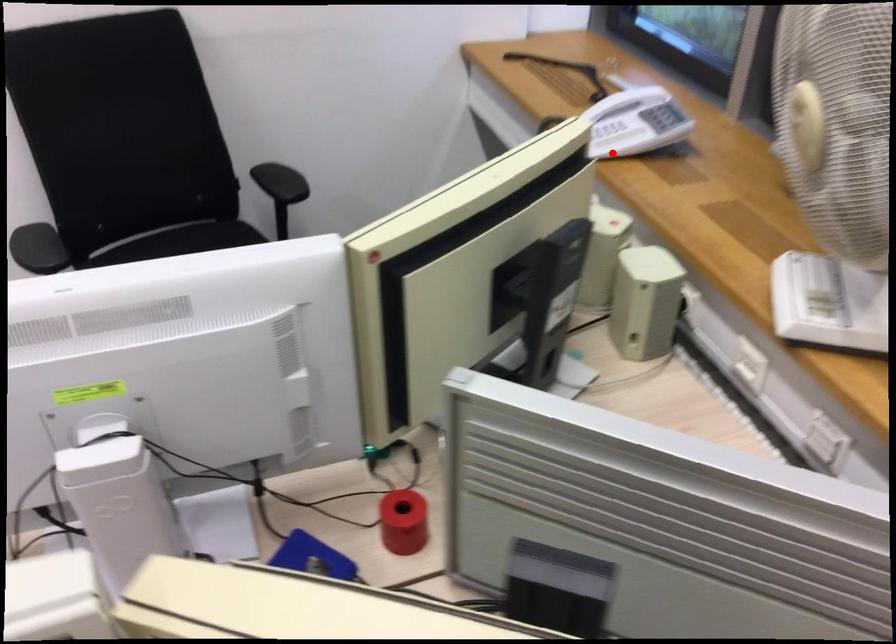
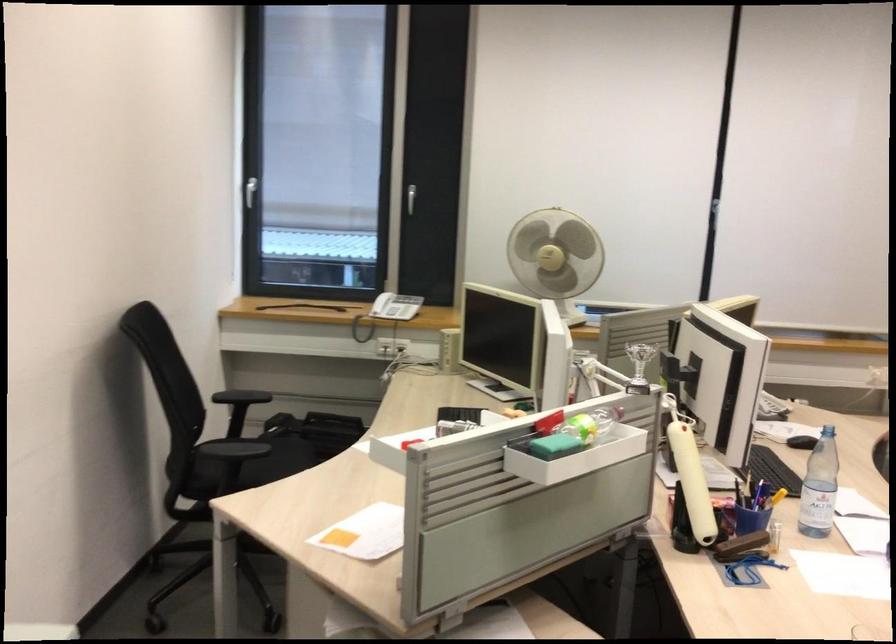
Question: I am providing you with two images of the same scene from different viewpoints. In image1, a red point is highlighted. Considering the same 3D point in image2, which of the following is correct?

Choices:
 (A) It is closer
 (B) It is farther

Answer: (B)